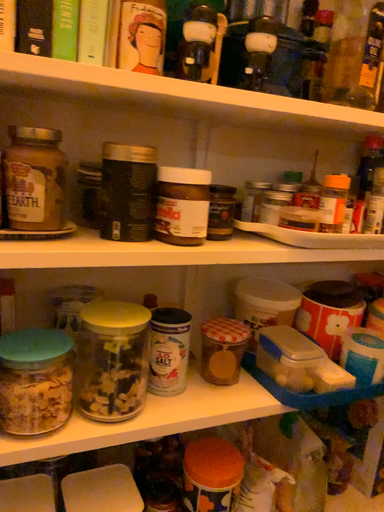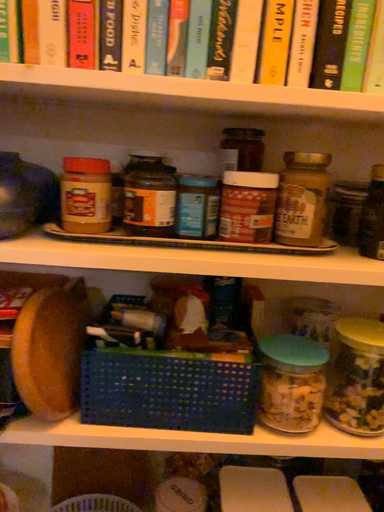
Question: Which way did the camera rotate in the video?

Choices:
 (A) rotated right
 (B) rotated left

Answer: (B)